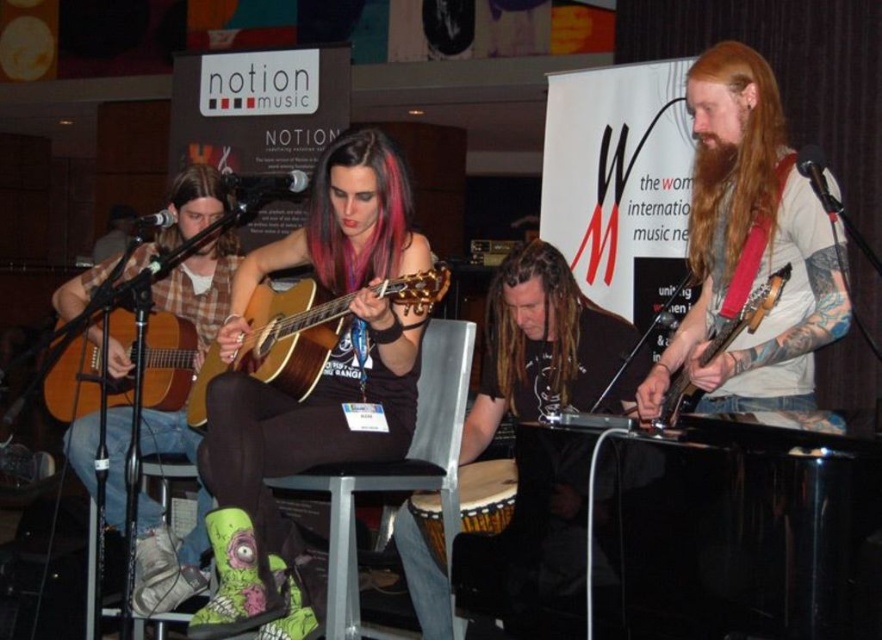
You are a stagehand who needs to move the matte black guitar at center and the wooden drum at lower center closer together by 5 inches. How far apart will they be after you adjust them?

The matte black guitar at center is currently 20.06 inches away from the wooden drum at lower center. After moving them closer by 5 inches, the distance between them will be 15.06 inches.

You are a photographer setting up for a live music session. You need to place a microphone stand between the matte black guitar at center and the wooden drum at lower center. The stand requires 1 meter of space. Given the width of the two instruments, can you estimate if there is enough space between them to place the microphone stand?

The matte black guitar at center is wider than the wooden drum at lower center. Since the stand requires 1 meter of space, but the description only provides the relative widths of the instruments, not the actual distance between them, it is impossible to determine if there is enough space without additional information about their separation.

Consider the image. You are a photographer positioned at the back of the room. You want to capture a clear photo of the wooden acoustic guitar at center without the wooden drum at lower center blocking it. What should you do?

The wooden acoustic guitar at center is in front of the wooden drum at lower center. To avoid the drum blocking the guitar, you should adjust your angle or move closer to focus on the guitar while ensuring the drum is out of frame.